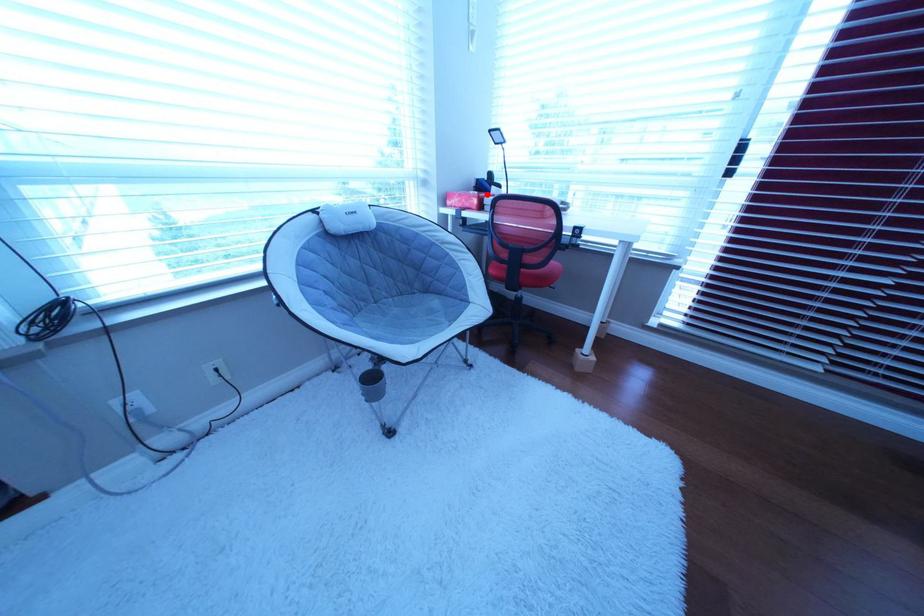
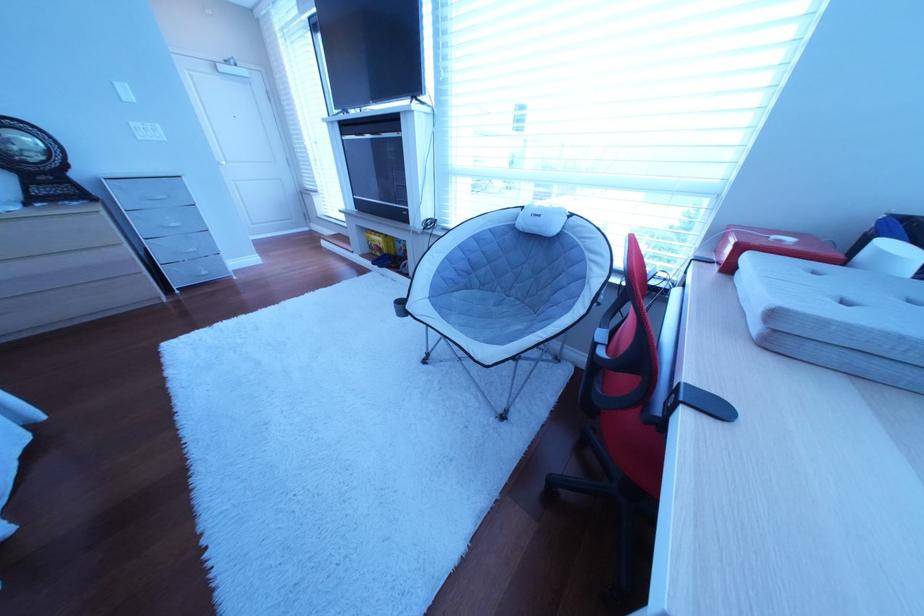
In the second image, find the point that corresponds to the highlighted location in the first image.

(789, 238)